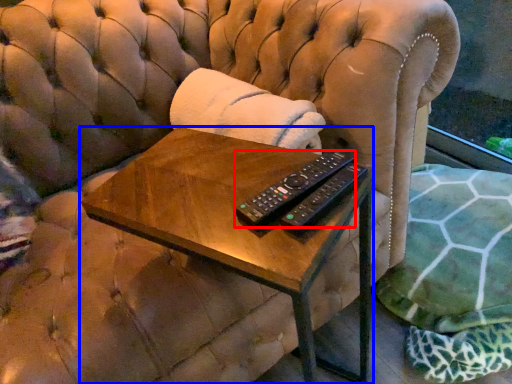
Question: Which of the following is the farthest to the observer, remote control (highlighted by a red box) or table (highlighted by a blue box)?

Choices:
 (A) remote control
 (B) table

Answer: (A)